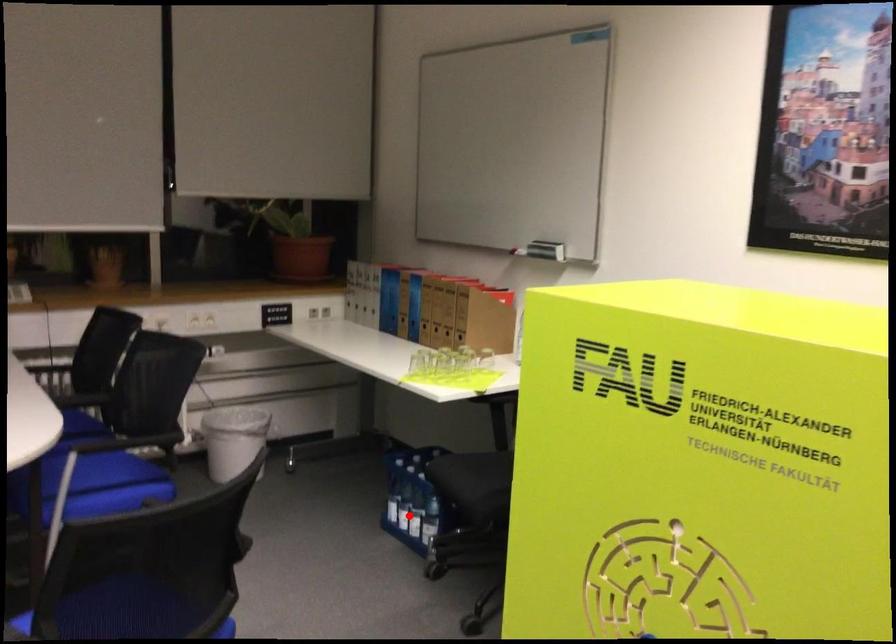
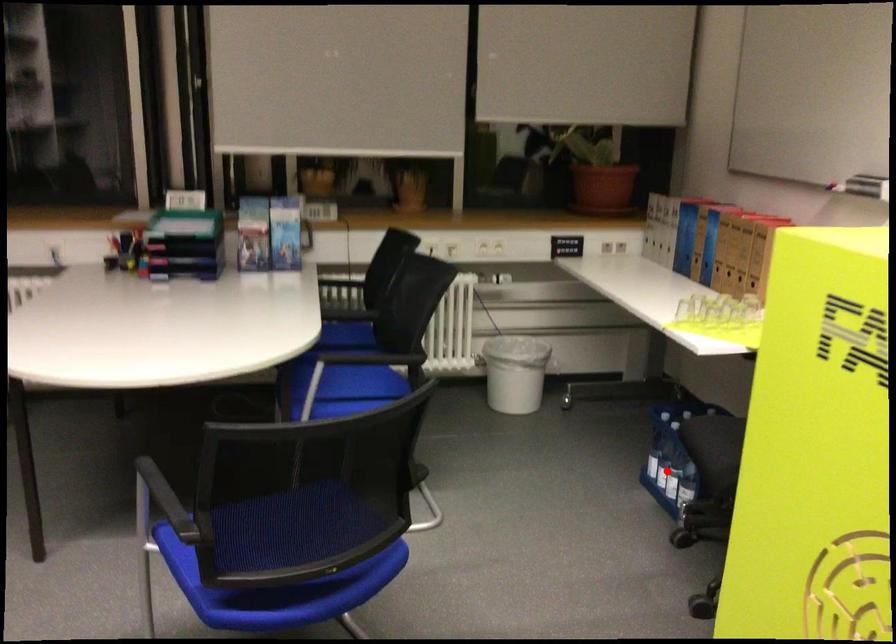
I am providing you with two images of the same scene from different viewpoints. A red point is marked on the first image and another point is marked on the second image. Does the point marked in image1 correspond to the same location as the one in image2?

Yes